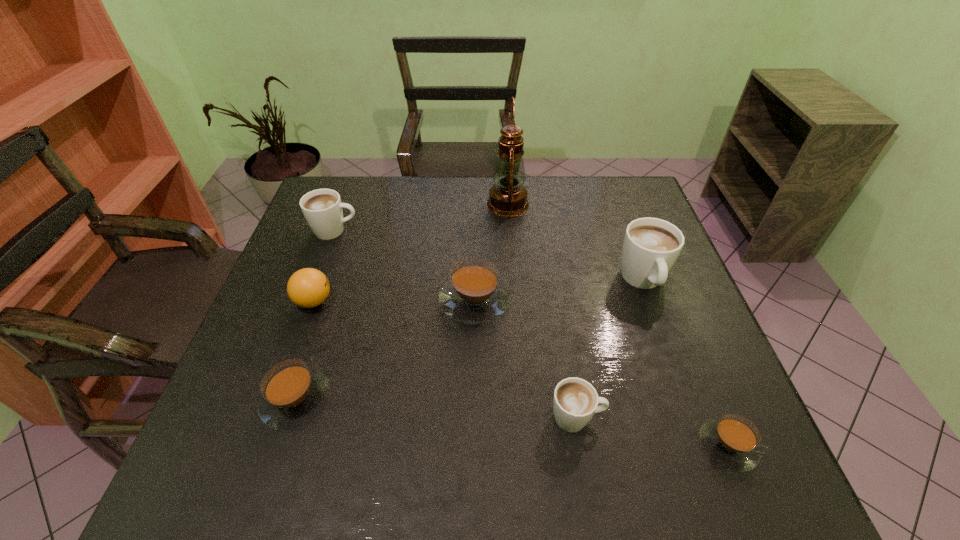
This screenshot has width=960, height=540. In order to click on the leftmost brown cappuccino in this screenshot , I will do `click(293, 394)`.

Where is `the rightmost brown cappuccino`? The height and width of the screenshot is (540, 960). the rightmost brown cappuccino is located at coordinates (732, 441).

The image size is (960, 540). Find the location of `the shortest object`. the shortest object is located at coordinates (732, 441).

The width and height of the screenshot is (960, 540). I want to click on vacant space positioned 0.210m on the left of the tallest object, so click(x=420, y=204).

At what (x,y) coordinates should I click in order to perform the action: click on free space located with the handle on the side of the second tallest object. Please return your answer as a coordinate pair (x, y). Looking at the image, I should click on (680, 381).

Find the location of a particular element. vacant region located with the handle on the side of the farthest white cappuccino is located at coordinates (444, 231).

Locate an element on the screen. This screenshot has width=960, height=540. blank space located 0.120m on the side with brand of the ping-pong ball is located at coordinates (381, 301).

This screenshot has width=960, height=540. Find the location of `vacant space located 0.190m on the left of the farthest brown cappuccino`. vacant space located 0.190m on the left of the farthest brown cappuccino is located at coordinates (363, 300).

I want to click on blank space located with the handle on the side of the third cappuccino from right to left, so click(x=693, y=418).

Identify the location of vacant area situated on the back of the leftmost brown cappuccino. (344, 253).